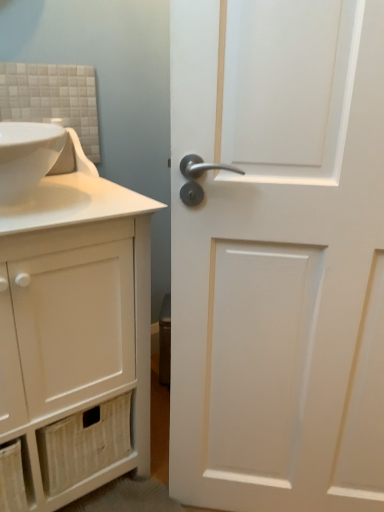
Question: Is white glossy sink at upper left located outside white matte door at right?

Choices:
 (A) no
 (B) yes

Answer: (B)

Question: Is white glossy sink at upper left with white matte door at right?

Choices:
 (A) yes
 (B) no

Answer: (B)

Question: Is white glossy sink at upper left closer to camera compared to white matte door at right?

Choices:
 (A) yes
 (B) no

Answer: (B)

Question: Is white matte door at right surrounded by white glossy sink at upper left?

Choices:
 (A) no
 (B) yes

Answer: (A)

Question: Considering the relative positions of white glossy sink at upper left and white matte door at right in the image provided, is white glossy sink at upper left to the left of white matte door at right from the viewer's perspective?

Choices:
 (A) yes
 (B) no

Answer: (A)

Question: Is white matte cabinet at left wider or thinner than white matte door at right?

Choices:
 (A) wide
 (B) thin

Answer: (A)

Question: From their relative heights in the image, would you say white matte cabinet at left is taller or shorter than white matte door at right?

Choices:
 (A) tall
 (B) short

Answer: (B)

Question: Is point (100, 428) closer or farther from the camera than point (200, 431)?

Choices:
 (A) closer
 (B) farther

Answer: (B)

Question: Visually, is white matte cabinet at left positioned to the left or to the right of white matte door at right?

Choices:
 (A) right
 (B) left

Answer: (B)

Question: Looking at the image, does white matte cabinet at left seem bigger or smaller compared to white glossy sink at upper left?

Choices:
 (A) big
 (B) small

Answer: (A)

Question: From the image's perspective, is white matte cabinet at left above or below white glossy sink at upper left?

Choices:
 (A) above
 (B) below

Answer: (B)

Question: Do you think white matte cabinet at left is within white glossy sink at upper left, or outside of it?

Choices:
 (A) outside
 (B) inside

Answer: (A)

Question: Considering the positions of white matte cabinet at left and white glossy sink at upper left in the image, is white matte cabinet at left taller or shorter than white glossy sink at upper left?

Choices:
 (A) short
 (B) tall

Answer: (B)

Question: From the image's perspective, is white matte door at right above or below white matte cabinet at left?

Choices:
 (A) above
 (B) below

Answer: (A)

Question: Based on their positions, is white matte door at right located to the left or right of white matte cabinet at left?

Choices:
 (A) left
 (B) right

Answer: (B)